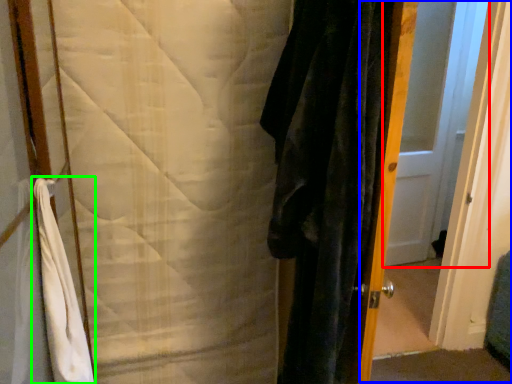
Question: Which object is positioned closest to door (highlighted by a red box)? Select from screen door (highlighted by a blue box) and bath towel (highlighted by a green box).

Choices:
 (A) screen door
 (B) bath towel

Answer: (A)